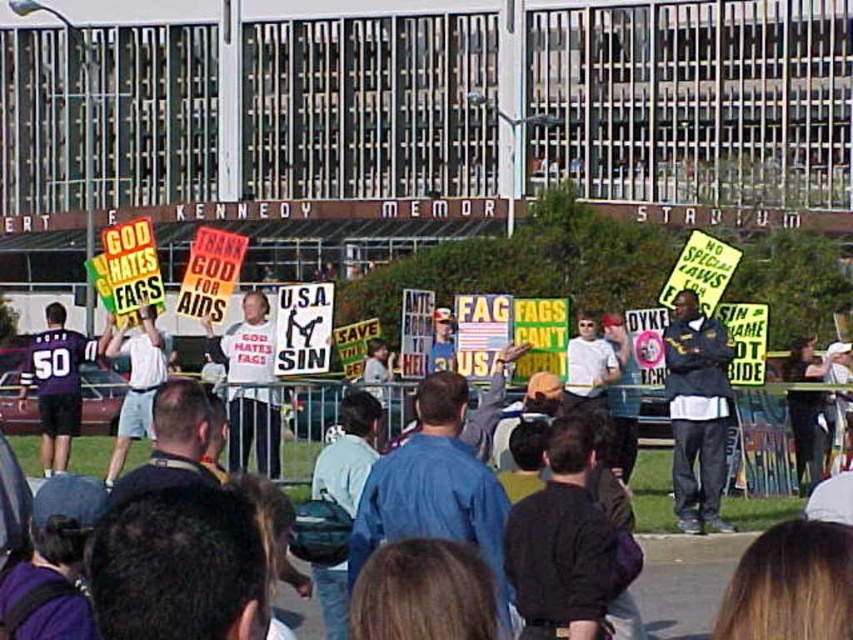
Which is behind, point (44, 384) or point (120, 355)?

Positioned behind is point (120, 355).

Between matte purple jersey at left and white cotton shirt at center, which one has more height?

matte purple jersey at left

Is point (64, 356) farther from camera compared to point (163, 380)?

Yes, point (64, 356) is behind point (163, 380).

The height and width of the screenshot is (640, 853). In order to click on matte purple jersey at left in this screenshot , I will do `click(57, 381)`.

Is dark blue jacket at center thinner than matte purple jersey at left?

Yes, dark blue jacket at center is thinner than matte purple jersey at left.

Does dark blue jacket at center appear on the left side of matte purple jersey at left?

Incorrect, dark blue jacket at center is not on the left side of matte purple jersey at left.

At what (x,y) coordinates should I click in order to perform the action: click on dark blue jacket at center. Please return your answer as a coordinate pair (x, y). This screenshot has height=640, width=853. Looking at the image, I should click on (697, 412).

The width and height of the screenshot is (853, 640). I want to click on dark blue jacket at center, so click(697, 412).

Is dark blue jacket at center to the right of white cotton shirt at center from the viewer's perspective?

Indeed, dark blue jacket at center is positioned on the right side of white cotton shirt at center.

Between dark blue jacket at center and white cotton shirt at center, which one has less height?

Standing shorter between the two is white cotton shirt at center.

Which is in front, point (688, 324) or point (138, 404)?

Positioned in front is point (688, 324).

At what (x,y) coordinates should I click in order to perform the action: click on dark blue jacket at center. Please return your answer as a coordinate pair (x, y). The height and width of the screenshot is (640, 853). Looking at the image, I should click on (697, 412).